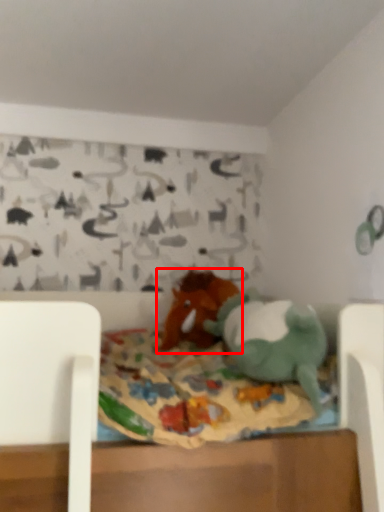
Question: In this image, where is toy (annotated by the red box) located relative to toy?

Choices:
 (A) right
 (B) left

Answer: (B)